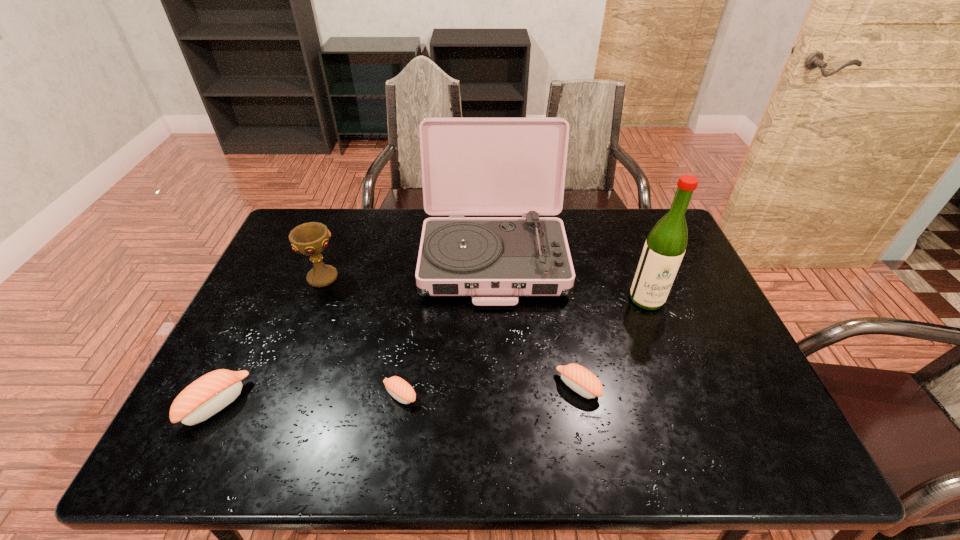
I want to click on object located in the near left corner section of the desktop, so click(x=206, y=396).

In the image, there is a desktop. At what (x,y) coordinates should I click in order to perform the action: click on vacant area at the far edge. Please return your answer as a coordinate pair (x, y). The height and width of the screenshot is (540, 960). Looking at the image, I should click on (571, 221).

Locate an element on the screen. The width and height of the screenshot is (960, 540). vacant area at the near edge is located at coordinates (632, 393).

Where is `free space at the right edge`? free space at the right edge is located at coordinates (664, 313).

Locate an element on the screen. free space at the far left corner of the desktop is located at coordinates (299, 209).

I want to click on free spot at the near left corner of the desktop, so click(x=250, y=397).

This screenshot has height=540, width=960. What are the coordinates of `vacant space at the near right corner of the desktop` in the screenshot? It's located at (723, 397).

Locate an element on the screen. vacant space in between the third tallest object and the fifth tallest object is located at coordinates (450, 332).

Find the location of a particular element. The width and height of the screenshot is (960, 540). free area in between the rightmost sushi and the shortest sushi is located at coordinates (489, 390).

Where is `vacant area between the record player and the fourth shortest object`? vacant area between the record player and the fourth shortest object is located at coordinates (408, 267).